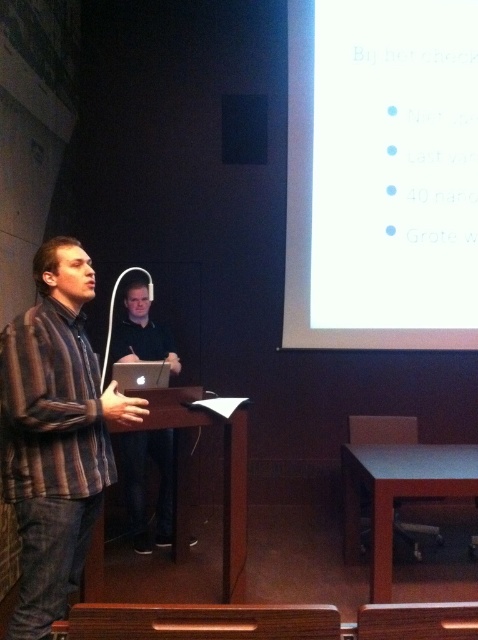
Question: Based on their relative distances, which object is farther from the brown striped shirt at left?

Choices:
 (A) white glossy projection screen at upper right
 (B) matte black laptop at center

Answer: (A)

Question: Does white glossy projection screen at upper right have a smaller size compared to brown striped shirt at left?

Choices:
 (A) no
 (B) yes

Answer: (A)

Question: Is white glossy projection screen at upper right smaller than matte black laptop at center?

Choices:
 (A) yes
 (B) no

Answer: (B)

Question: Which point is farther from the camera taking this photo?

Choices:
 (A) (148, 321)
 (B) (432, 301)
 (C) (8, 326)

Answer: (B)

Question: In this image, where is brown striped shirt at left located relative to matte black laptop at center?

Choices:
 (A) above
 (B) below

Answer: (A)

Question: Which of the following is the closest to the observer?

Choices:
 (A) white glossy projection screen at upper right
 (B) matte black laptop at center
 (C) brown striped shirt at left

Answer: (C)